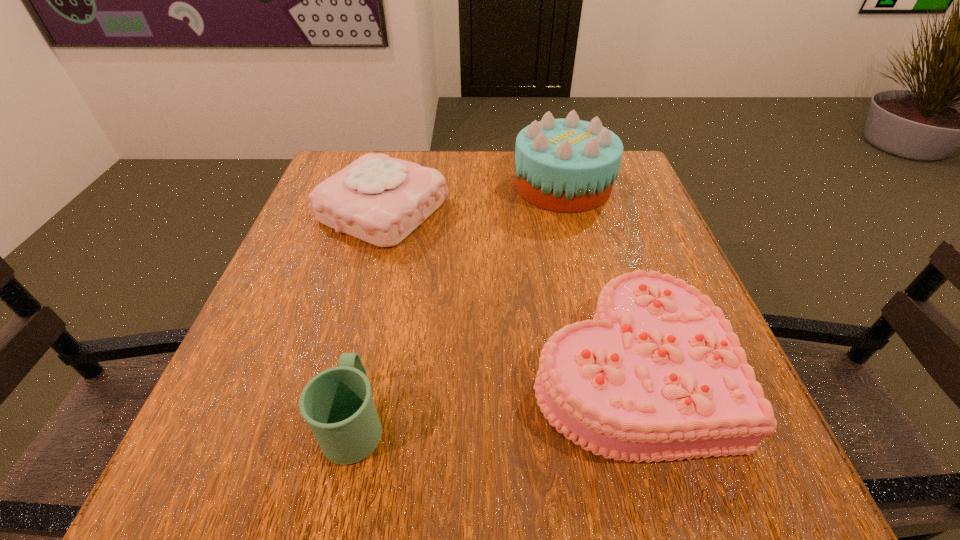
I want to click on free space located on the back of the nearest cake, so click(x=578, y=195).

At what (x,y) coordinates should I click in order to perform the action: click on mug located at the near edge. Please return your answer as a coordinate pair (x, y). Looking at the image, I should click on (337, 403).

I want to click on cake that is at the near edge, so click(658, 374).

Where is `object that is at the left edge`? This screenshot has width=960, height=540. object that is at the left edge is located at coordinates (378, 199).

Find the location of `object situated at the far left corner`. object situated at the far left corner is located at coordinates (378, 199).

The image size is (960, 540). In order to click on object present at the far right corner in this screenshot , I will do `click(568, 165)`.

The width and height of the screenshot is (960, 540). I want to click on object that is at the near right corner, so click(658, 374).

I want to click on vacant space at the far edge, so click(427, 162).

In the image, there is a desktop. Identify the location of free space at the left edge. The height and width of the screenshot is (540, 960). (200, 421).

Identify the location of vacant area at the right edge of the desktop. Image resolution: width=960 pixels, height=540 pixels. point(632,263).